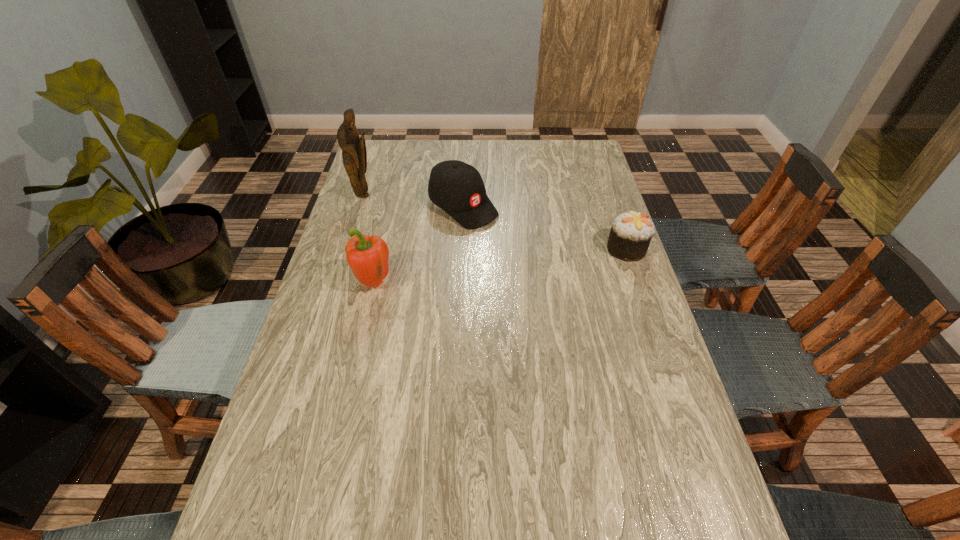
Where is `empty space between the baseball cap and the figurine`? The image size is (960, 540). empty space between the baseball cap and the figurine is located at coordinates (414, 201).

Find the location of a particular element. object that is the second closest one to the baseball cap is located at coordinates (368, 257).

Identify which object is located as the nearest to the third farthest object. Please provide its 2D coordinates. Your answer should be formatted as a tuple, i.e. [(x, y)], where the tuple contains the x and y coordinates of a point satisfying the conditions above.

[(456, 187)]

At what (x,y) coordinates should I click in order to perform the action: click on vacant space that satisfies the following two spatial constraints: 1. on the front side of the baseball cap; 2. on the left side of the third farthest object. Please return your answer as a coordinate pair (x, y). This screenshot has height=540, width=960. Looking at the image, I should click on (462, 249).

Find the location of `free space that satisfies the following two spatial constraints: 1. on the front side of the figurine; 2. on the right side of the baseball cap`. free space that satisfies the following two spatial constraints: 1. on the front side of the figurine; 2. on the right side of the baseball cap is located at coordinates (362, 206).